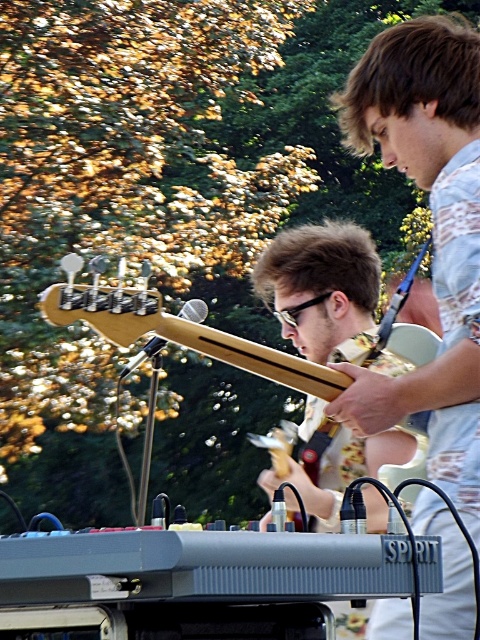
What object is located at the coordinates point (322, 289) in the image?

The point (322, 289) marks the location of the matte wood guitar at center.

You are a stagehand setting up for a performance. You have two guitars, the matte wood guitar at center and the light wood electric guitar at center. Which guitar should you choose if you need to place it in a narrow guitar stand that can only accommodate guitars less than 5 cm in thickness?

The matte wood guitar at center is thinner than the light wood electric guitar at center, so you should choose the matte wood guitar at center for the narrow guitar stand.